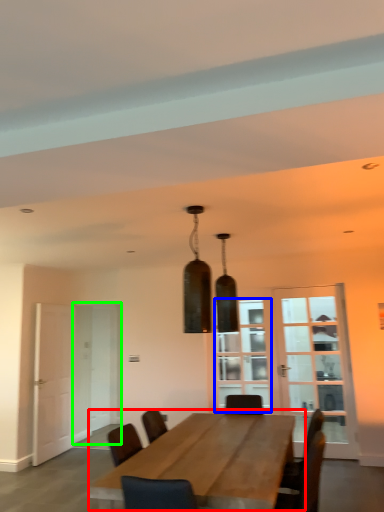
Question: Estimate the real-world distances between objects in this image. Which object is farther from table (highlighted by a red box), window (highlighted by a blue box) or glass door (highlighted by a green box)?

Choices:
 (A) window
 (B) glass door

Answer: (B)